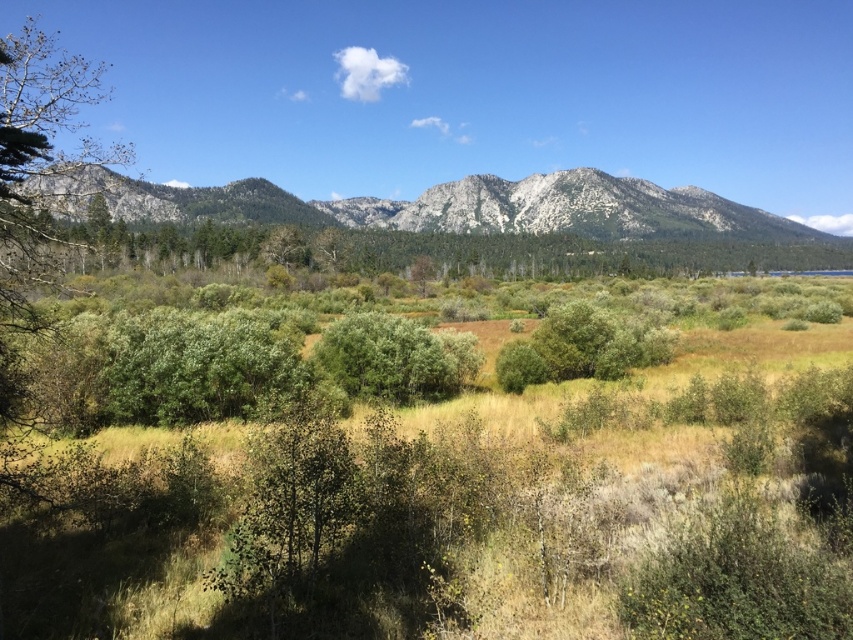
The height and width of the screenshot is (640, 853). Identify the location of gray rocky mountain range at center. (440, 205).

Is gray rocky mountain range at center wider than green leafy bush at center?

Indeed, gray rocky mountain range at center has a greater width compared to green leafy bush at center.

Image resolution: width=853 pixels, height=640 pixels. In order to click on gray rocky mountain range at center in this screenshot , I will do `click(440, 205)`.

Does green leafy trees at center have a smaller size compared to green leafy bush at center?

No, green leafy trees at center is not smaller than green leafy bush at center.

This screenshot has height=640, width=853. Describe the element at coordinates (416, 250) in the screenshot. I see `green leafy trees at center` at that location.

This screenshot has width=853, height=640. Describe the element at coordinates (416, 250) in the screenshot. I see `green leafy trees at center` at that location.

The height and width of the screenshot is (640, 853). I want to click on green leafy trees at center, so click(x=416, y=250).

At what (x,y) coordinates should I click in order to perform the action: click on gray rocky mountain range at center. Please return your answer as a coordinate pair (x, y). This screenshot has width=853, height=640. Looking at the image, I should click on (440, 205).

Can you confirm if gray rocky mountain range at center is positioned to the left of green leafy trees at center?

Yes, gray rocky mountain range at center is to the left of green leafy trees at center.

Is point (566, 198) behind point (137, 237)?

Yes, it is.

This screenshot has width=853, height=640. I want to click on gray rocky mountain range at center, so click(440, 205).